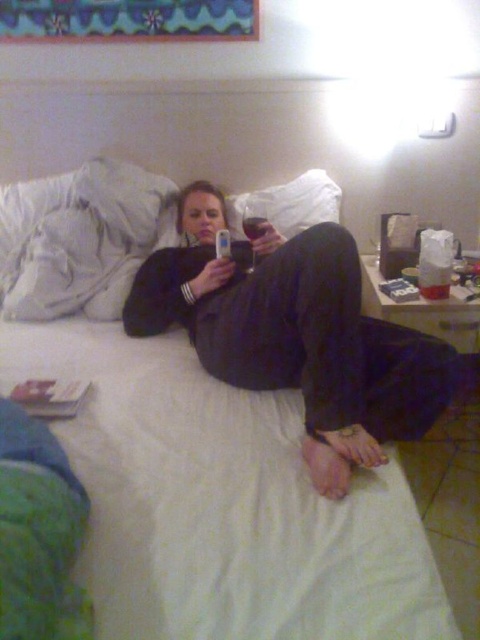
Question: Based on their relative distances, which object is farther from the white soft pillow at upper left?

Choices:
 (A) white fabric bed at center
 (B) matte black phone at center

Answer: (B)

Question: Which point is closer to the camera?

Choices:
 (A) matte black phone at center
 (B) white soft pillow at upper left
 (C) white fabric bed at center

Answer: (C)

Question: Can you confirm if white fabric bed at center is positioned above white soft pillow at upper left?

Choices:
 (A) no
 (B) yes

Answer: (A)

Question: Which of the following is the farthest from the observer?

Choices:
 (A) white soft pillow at upper left
 (B) matte black phone at center
 (C) white fabric bed at center

Answer: (A)

Question: Does matte black phone at center appear on the left side of white soft pillow at upper left?

Choices:
 (A) no
 (B) yes

Answer: (A)

Question: Is matte black phone at center positioned at the back of white soft pillow at upper left?

Choices:
 (A) yes
 (B) no

Answer: (B)